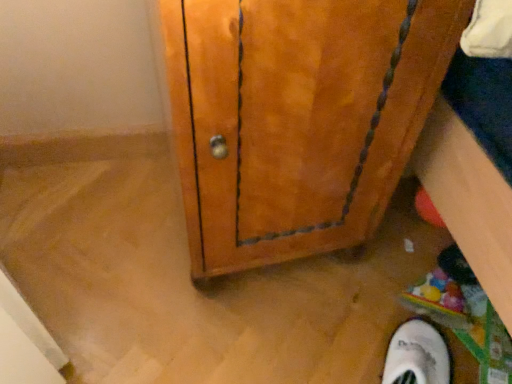
Question: Is white suede shoe at lower right to the left or to the right of wooden cabinet at center in the image?

Choices:
 (A) right
 (B) left

Answer: (A)

Question: From a real-world perspective, is white suede shoe at lower right positioned above or below wooden cabinet at center?

Choices:
 (A) below
 (B) above

Answer: (A)

Question: Relative to wooden cabinet at center, is white suede shoe at lower right in front or behind?

Choices:
 (A) behind
 (B) front

Answer: (A)

Question: Is wooden cabinet at center wider or thinner than white suede shoe at lower right?

Choices:
 (A) wide
 (B) thin

Answer: (A)

Question: Is point (293, 92) positioned closer to the camera than point (384, 377)?

Choices:
 (A) farther
 (B) closer

Answer: (B)

Question: Considering the positions of wooden cabinet at center and white suede shoe at lower right in the image, is wooden cabinet at center bigger or smaller than white suede shoe at lower right?

Choices:
 (A) big
 (B) small

Answer: (A)

Question: From a real-world perspective, is wooden cabinet at center physically located above or below white suede shoe at lower right?

Choices:
 (A) below
 (B) above

Answer: (B)